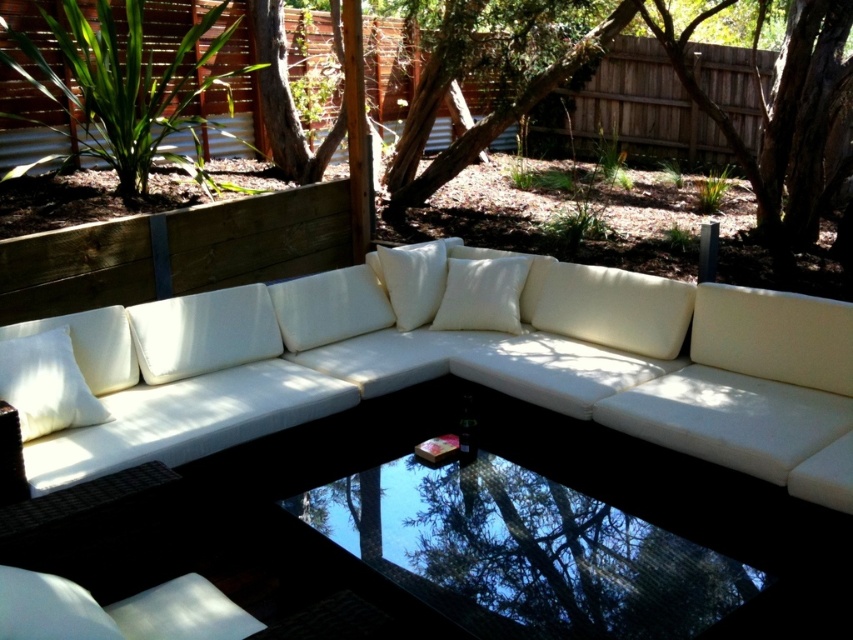
Question: Is white matte pillow at center below white soft cushion at center?

Choices:
 (A) yes
 (B) no

Answer: (A)

Question: Which of the following is the farthest from the observer?

Choices:
 (A) white fabric pillow at center
 (B) white matte pillow at center
 (C) white matte pillow at left

Answer: (A)

Question: Does white fabric couch at center have a larger size compared to white matte pillow at center?

Choices:
 (A) no
 (B) yes

Answer: (B)

Question: Is white fabric couch at center thinner than white matte pillow at left?

Choices:
 (A) no
 (B) yes

Answer: (A)

Question: Which point is farther from the camera taking this photo?

Choices:
 (A) (432, 298)
 (B) (631, 602)

Answer: (A)

Question: Which of these objects is positioned farthest from the transparent glass table at center?

Choices:
 (A) white matte pillow at center
 (B) white soft cushion at center

Answer: (B)